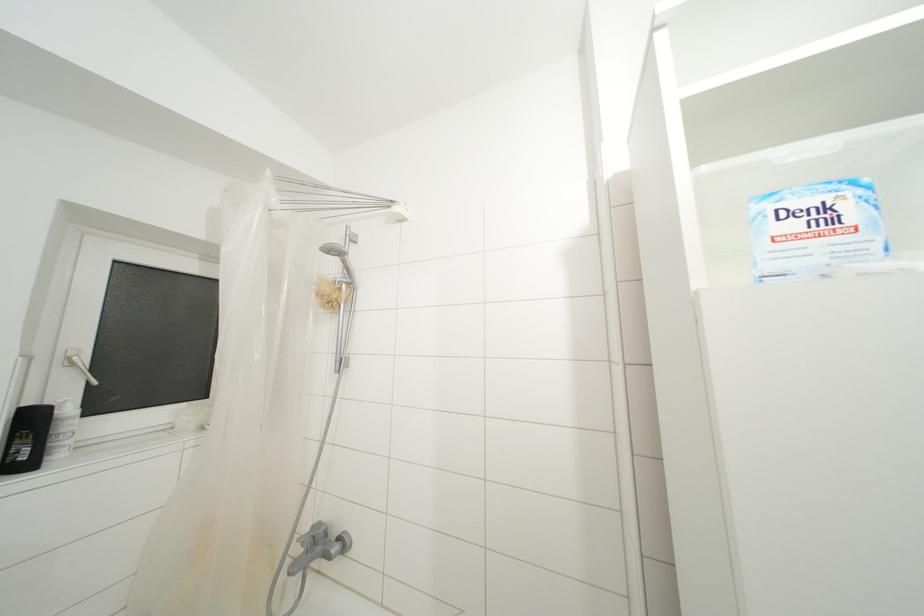
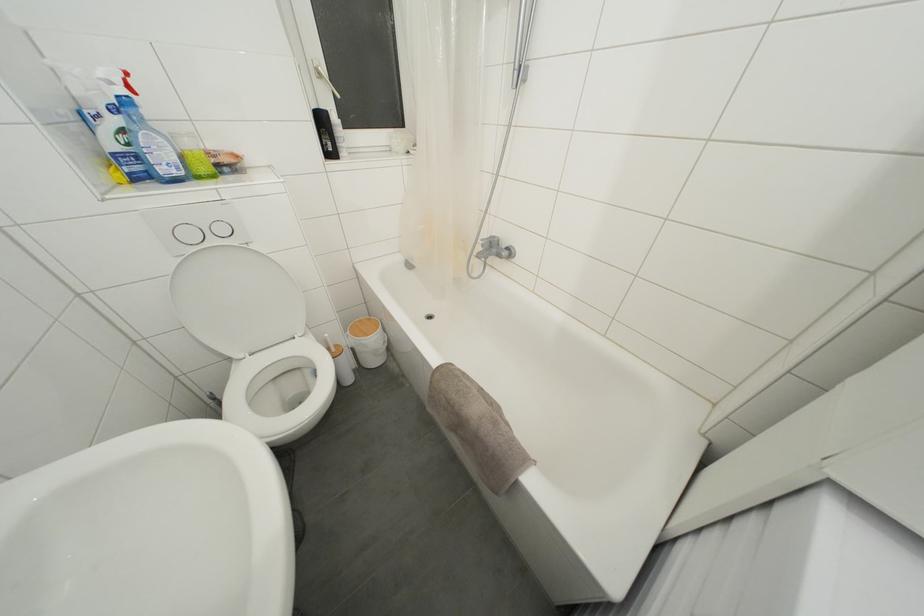
Find the pixel in the second image that matches point (308, 533) in the first image.

(488, 240)